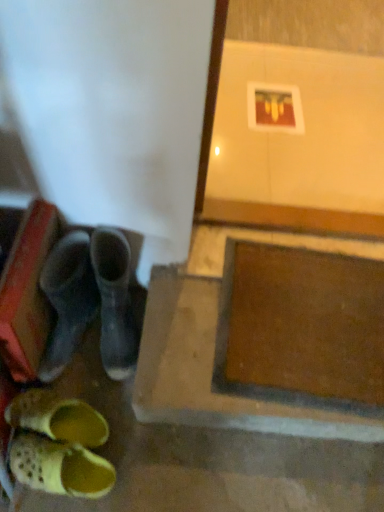
Locate an element on the screen. free spot above brown matte concrete at lower right (from a real-world perspective) is located at coordinates (264, 338).